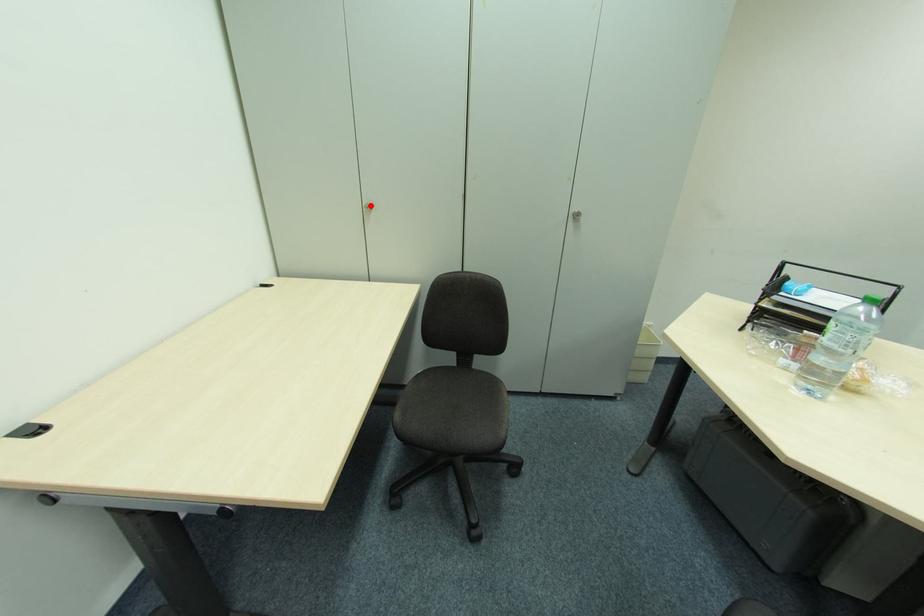
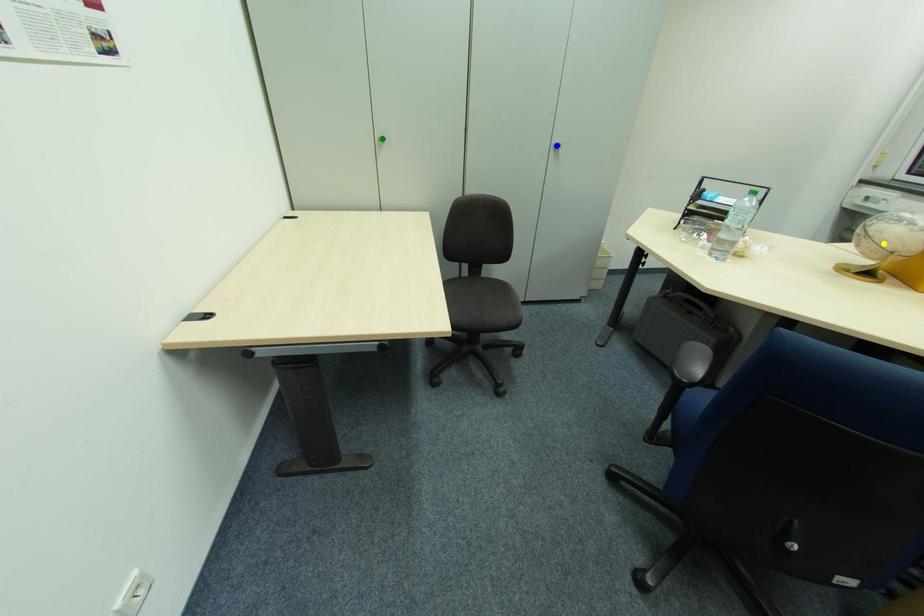
Question: I am providing you with two images of the same scene from different viewpoints. A red point is marked on the first image. You are given multiple points on the second image. Which point in image 2 represents the same 3d spot as the red point in image 1?

Choices:
 (A) blue point
 (B) green point
 (C) yellow point

Answer: (B)